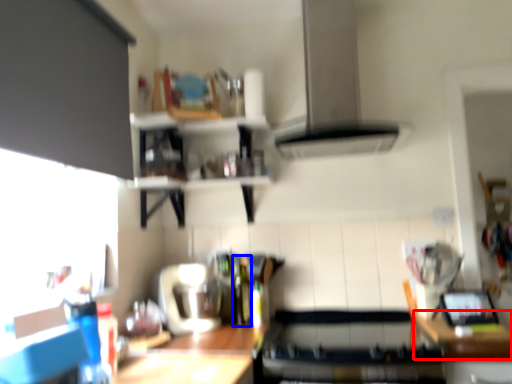
Question: Which object is further to the camera taking this photo, counter top (highlighted by a red box) or bottle (highlighted by a blue box)?

Choices:
 (A) counter top
 (B) bottle

Answer: (B)